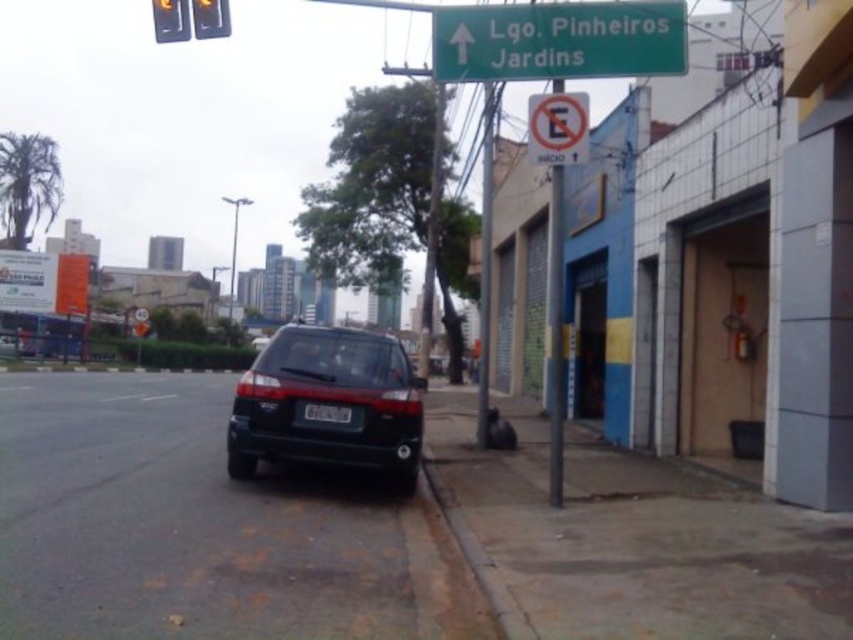
Does metallic pole at center appear under black plastic license plate at center?

No.

Find the location of a particular element. The image size is (853, 640). metallic pole at center is located at coordinates (554, 339).

What do you see at coordinates (328, 403) in the screenshot?
I see `shiny black suv at center` at bounding box center [328, 403].

How much distance is there between shiny black suv at center and black plastic license plate at center?

A distance of 11.05 inches exists between shiny black suv at center and black plastic license plate at center.

Measure the distance between point (358, 428) and camera.

6.29 meters

At what (x,y) coordinates should I click in order to perform the action: click on shiny black suv at center. Please return your answer as a coordinate pair (x, y). The height and width of the screenshot is (640, 853). Looking at the image, I should click on (328, 403).

Can you confirm if green metallic sign at upper center is positioned below metallic pole at center?

Actually, green metallic sign at upper center is above metallic pole at center.

Is green metallic sign at upper center smaller than metallic pole at center?

Indeed, green metallic sign at upper center has a smaller size compared to metallic pole at center.

Locate an element on the screen. The image size is (853, 640). green metallic sign at upper center is located at coordinates (558, 40).

Locate an element on the screen. This screenshot has width=853, height=640. green metallic sign at upper center is located at coordinates (558, 40).